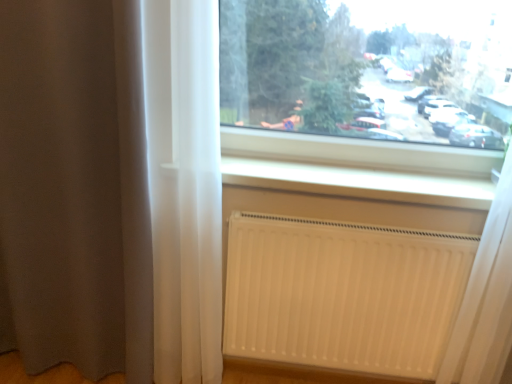
This screenshot has height=384, width=512. Describe the element at coordinates (342, 293) in the screenshot. I see `white matte radiator at lower right` at that location.

The width and height of the screenshot is (512, 384). What are the coordinates of `white matte radiator at lower right` in the screenshot? It's located at 342,293.

How much distance is there between white matte radiator at lower right and white smooth radiator at lower center?

white matte radiator at lower right is 12.76 inches away from white smooth radiator at lower center.

Which of these two, white matte radiator at lower right or white smooth radiator at lower center, stands shorter?

Standing shorter between the two is white smooth radiator at lower center.

From the picture: From a real-world perspective, is white matte radiator at lower right above or below white smooth radiator at lower center?

In terms of real-world spatial position, white matte radiator at lower right is below white smooth radiator at lower center.

Is point (351, 355) positioned in front of point (303, 173)?

No.

Could you tell me if transparent glass window at upper center is facing brown sheer curtain at left?

No, transparent glass window at upper center is not oriented towards brown sheer curtain at left.

Is transparent glass window at upper center shorter than brown sheer curtain at left?

Yes, transparent glass window at upper center is shorter than brown sheer curtain at left.

Based on their sizes in the image, would you say transparent glass window at upper center is bigger or smaller than brown sheer curtain at left?

Considering their sizes, transparent glass window at upper center takes up less space than brown sheer curtain at left.

Are transparent glass window at upper center and brown sheer curtain at left making contact?

No, transparent glass window at upper center is not next to brown sheer curtain at left.

Is brown sheer curtain at left surrounding transparent glass window at upper center?

No, transparent glass window at upper center is not a part of brown sheer curtain at left.

Between brown sheer curtain at left and transparent glass window at upper center, which one has smaller width?

transparent glass window at upper center is thinner.

From the image's perspective, is brown sheer curtain at left under transparent glass window at upper center?

Result: Correct, brown sheer curtain at left appears lower than transparent glass window at upper center in the image.

From the picture: Is brown sheer curtain at left in front of transparent glass window at upper center?

Yes, brown sheer curtain at left is closer to the viewer.

Looking at this image, measure the distance from transparent glass window at upper center to white smooth radiator at lower center.

transparent glass window at upper center and white smooth radiator at lower center are 12.08 inches apart from each other.

Consider the image. Is transparent glass window at upper center outside of white smooth radiator at lower center?

That's correct, transparent glass window at upper center is outside of white smooth radiator at lower center.

From the image's perspective, which one is positioned higher, transparent glass window at upper center or white smooth radiator at lower center?

From the image's view, transparent glass window at upper center is above.

The image size is (512, 384). What are the coordinates of `window sill behind the transparent glass window at upper center` in the screenshot? It's located at (358, 183).

From the image's perspective, which one is positioned higher, white matte radiator at lower right or brown sheer curtain at left?

brown sheer curtain at left is shown above in the image.

Considering the relative sizes of white matte radiator at lower right and brown sheer curtain at left in the image provided, is white matte radiator at lower right thinner than brown sheer curtain at left?

Indeed, white matte radiator at lower right has a lesser width compared to brown sheer curtain at left.

Based on the photo, which of these two, white matte radiator at lower right or brown sheer curtain at left, stands shorter?

white matte radiator at lower right.

Considering the points (287, 264) and (47, 294), which point is behind, point (287, 264) or point (47, 294)?

Point (47, 294)

Could you tell me if white smooth radiator at lower center is turned towards transparent glass window at upper center?

No, white smooth radiator at lower center is not aimed at transparent glass window at upper center.

Which of these two, white smooth radiator at lower center or transparent glass window at upper center, is wider?

Wider between the two is white smooth radiator at lower center.

Does white smooth radiator at lower center have a lesser height compared to transparent glass window at upper center?

Correct, white smooth radiator at lower center is not as tall as transparent glass window at upper center.

How different are the orientations of white smooth radiator at lower center and transparent glass window at upper center in degrees?

There is a 0.000351-degree angle between the facing directions of white smooth radiator at lower center and transparent glass window at upper center.

Is point (485, 200) closer to camera compared to point (383, 347)?

Yes, it is in front of point (383, 347).

Is white smooth radiator at lower center positioned far away from white matte radiator at lower right?

No, white smooth radiator at lower center is not far away from white matte radiator at lower right.

Is white smooth radiator at lower center positioned with its back to white matte radiator at lower right?

No, white smooth radiator at lower center is not facing the opposite direction of white matte radiator at lower right.

Is white matte radiator at lower right surrounded by white smooth radiator at lower center?

No, white matte radiator at lower right is located outside of white smooth radiator at lower center.

Where is `radiator below the white smooth radiator at lower center (from a real-world perspective)`? The width and height of the screenshot is (512, 384). radiator below the white smooth radiator at lower center (from a real-world perspective) is located at coordinates (342, 293).

This screenshot has width=512, height=384. In order to click on window above the brown sheer curtain at left (from a real-world perspective) in this screenshot , I will do `click(369, 69)`.

Based on their spatial positions, is white smooth radiator at lower center or brown sheer curtain at left further from transparent glass window at upper center?

brown sheer curtain at left lies further to transparent glass window at upper center than the other object.

From the image, which object appears to be nearer to transparent glass window at upper center, white matte radiator at lower right or white smooth radiator at lower center?

white smooth radiator at lower center is positioned closer to the anchor transparent glass window at upper center.

Considering their positions, is brown sheer curtain at left positioned closer to transparent glass window at upper center than white matte radiator at lower right?

The object closer to transparent glass window at upper center is white matte radiator at lower right.

Estimate the real-world distances between objects in this image. Which object is closer to transparent glass window at upper center, white smooth radiator at lower center or white matte radiator at lower right?

Among the two, white smooth radiator at lower center is located nearer to transparent glass window at upper center.

When comparing their distances from white matte radiator at lower right, does white smooth radiator at lower center or brown sheer curtain at left seem closer?

white smooth radiator at lower center lies closer to white matte radiator at lower right than the other object.

Looking at the image, which one is located further to white smooth radiator at lower center, white matte radiator at lower right or brown sheer curtain at left?

Based on the image, brown sheer curtain at left appears to be further to white smooth radiator at lower center.

Consider the image. Which object lies nearer to the anchor point white smooth radiator at lower center, brown sheer curtain at left or transparent glass window at upper center?

transparent glass window at upper center.

Looking at the image, which one is located closer to white matte radiator at lower right, transparent glass window at upper center or white smooth radiator at lower center?

white smooth radiator at lower center lies closer to white matte radiator at lower right than the other object.

Find the location of a particular element. The image size is (512, 384). radiator between brown sheer curtain at left and transparent glass window at upper center is located at coordinates (342, 293).

You are a GUI agent. You are given a task and a screenshot of the screen. Output one action in this format:
    pyautogui.click(x=<x>, y=<y>)
    Task: Click on the window sill between brown sheer curtain at left and transparent glass window at upper center in the horizontal direction
    This screenshot has height=384, width=512.
    Given the screenshot: What is the action you would take?
    pyautogui.click(x=358, y=183)

The height and width of the screenshot is (384, 512). I want to click on window sill that lies between transparent glass window at upper center and white matte radiator at lower right from top to bottom, so click(358, 183).

Locate an element on the screen. This screenshot has width=512, height=384. radiator located between brown sheer curtain at left and white smooth radiator at lower center in the left-right direction is located at coordinates (342, 293).